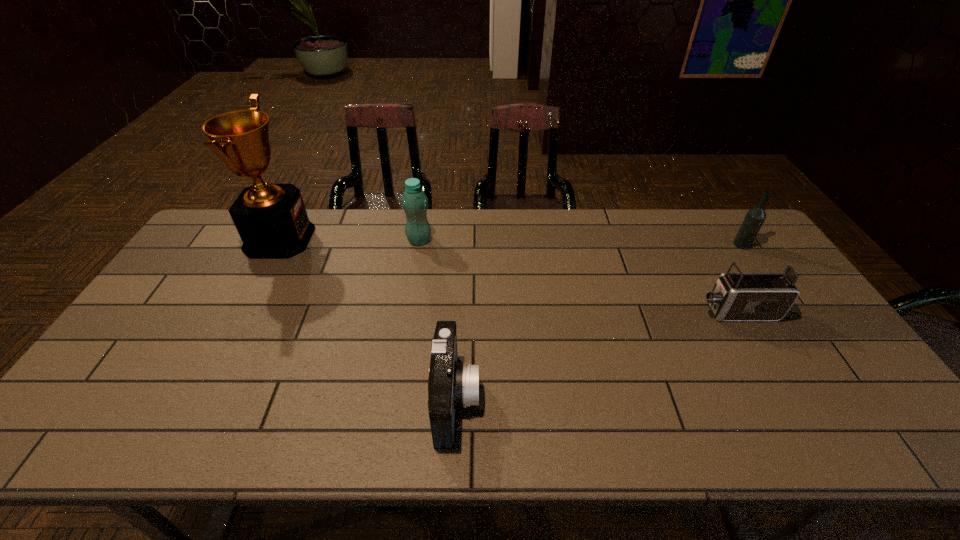
Find the location of a particular element. The image size is (960, 540). free spot located on the left of the vodka is located at coordinates (650, 245).

Locate an element on the screen. vacant space positioned at the lens of the second object from right to left is located at coordinates (588, 312).

I want to click on vacant position located at the lens of the second object from right to left, so click(673, 312).

Where is `vacant area situated at the lens of the second object from right to left`? vacant area situated at the lens of the second object from right to left is located at coordinates (585, 312).

The image size is (960, 540). I want to click on free space located on the lens of the nearer camcorder, so click(x=546, y=399).

At what (x,y) coordinates should I click in order to perform the action: click on trophy cup that is at the far edge. Please return your answer as a coordinate pair (x, y). The height and width of the screenshot is (540, 960). Looking at the image, I should click on [x=271, y=219].

This screenshot has height=540, width=960. I want to click on water bottle that is at the far edge, so click(414, 201).

Identify the location of vodka positioned at the far edge. (755, 217).

Identify the location of object at the near edge. The width and height of the screenshot is (960, 540). (451, 384).

Image resolution: width=960 pixels, height=540 pixels. I want to click on object located in the left edge section of the desktop, so click(x=271, y=219).